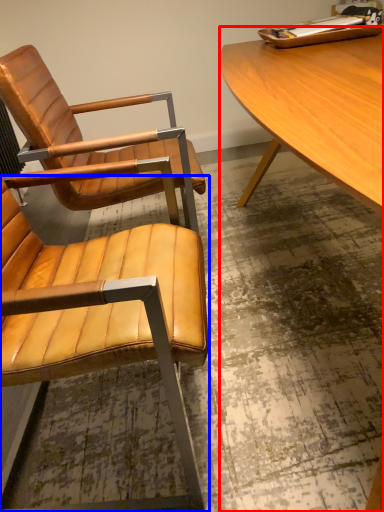
Question: Which object is closer to the camera taking this photo, desk (highlighted by a red box) or chair (highlighted by a blue box)?

Choices:
 (A) desk
 (B) chair

Answer: (A)